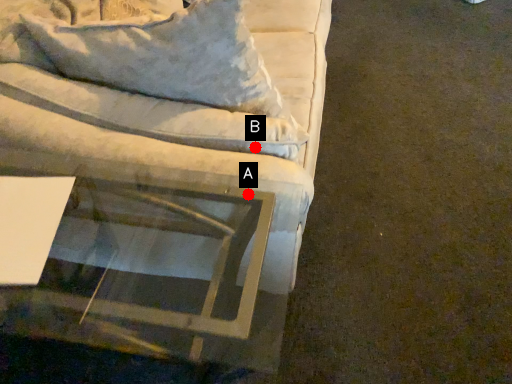
Question: Two points are circled on the image, labeled by A and B beside each circle. Which point is closer to the camera?

Choices:
 (A) A is closer
 (B) B is closer

Answer: (A)